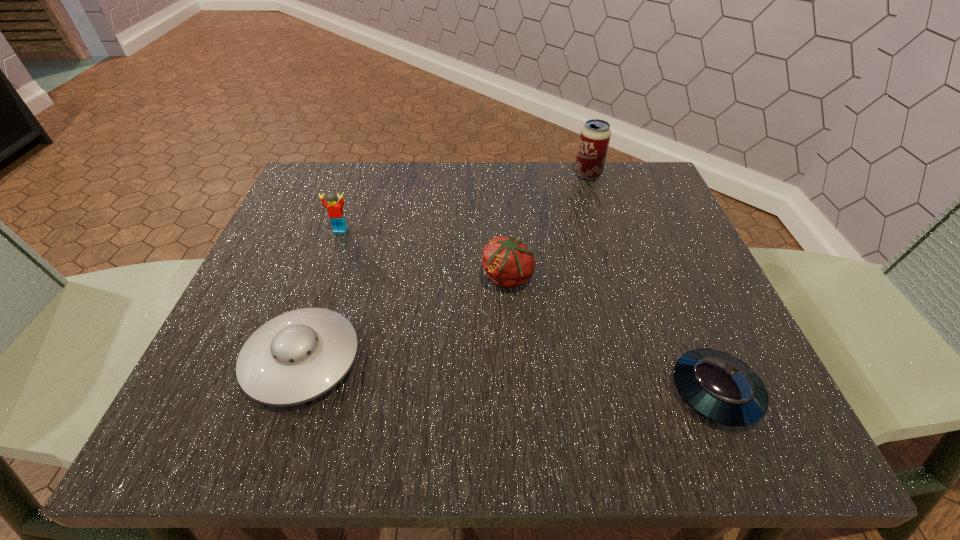
Find the location of `free location located 0.350m on the face of the second farthest object`. free location located 0.350m on the face of the second farthest object is located at coordinates (286, 384).

Where is `vacant position located on the front of the tomato`? vacant position located on the front of the tomato is located at coordinates (515, 396).

The height and width of the screenshot is (540, 960). Identify the location of vacant space located 0.210m on the right of the left saucer. (494, 360).

Locate an element on the screen. blank space located on the back of the right saucer is located at coordinates (676, 299).

At what (x,y) coordinates should I click in order to perform the action: click on object situated at the far edge. Please return your answer as a coordinate pair (x, y). This screenshot has height=540, width=960. Looking at the image, I should click on (595, 136).

Where is `Lego positioned at the left edge`? Lego positioned at the left edge is located at coordinates (335, 211).

Locate an element on the screen. The width and height of the screenshot is (960, 540). saucer situated at the left edge is located at coordinates (297, 356).

The image size is (960, 540). Find the location of `beer can at the right edge`. beer can at the right edge is located at coordinates (595, 136).

Where is `saucer present at the right edge`? saucer present at the right edge is located at coordinates click(x=722, y=388).

Identify the location of object at the near left corner. (297, 356).